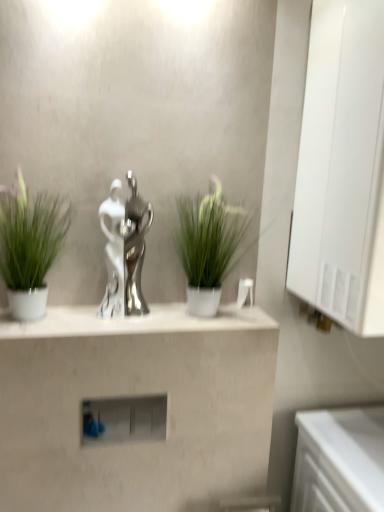
Identify the location of free space to the left of green matte plant at center, the first houseplant when ordered from right to left. (147, 318).